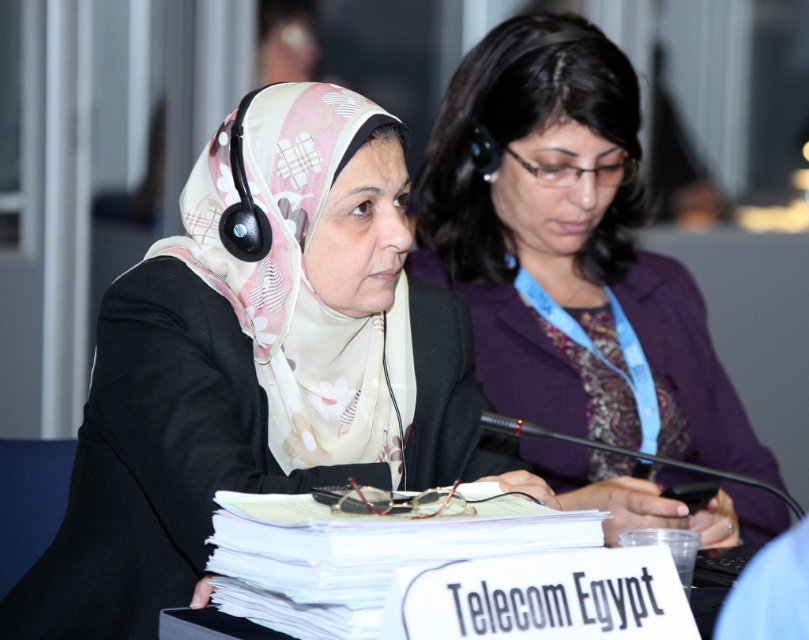
Question: Does matte black suit at center have a smaller size compared to purple fabric jacket at center?

Choices:
 (A) no
 (B) yes

Answer: (B)

Question: Which point is farther to the camera?

Choices:
 (A) matte black suit at center
 (B) purple fabric jacket at center

Answer: (B)

Question: Is matte black suit at center further to the viewer compared to purple fabric jacket at center?

Choices:
 (A) no
 (B) yes

Answer: (A)

Question: Which point is farther to the camera?

Choices:
 (A) (613, 332)
 (B) (388, 406)

Answer: (A)

Question: Is matte black suit at center in front of purple fabric jacket at center?

Choices:
 (A) yes
 (B) no

Answer: (A)

Question: Which point is farther to the camera?

Choices:
 (A) matte black suit at center
 (B) purple fabric jacket at center

Answer: (B)